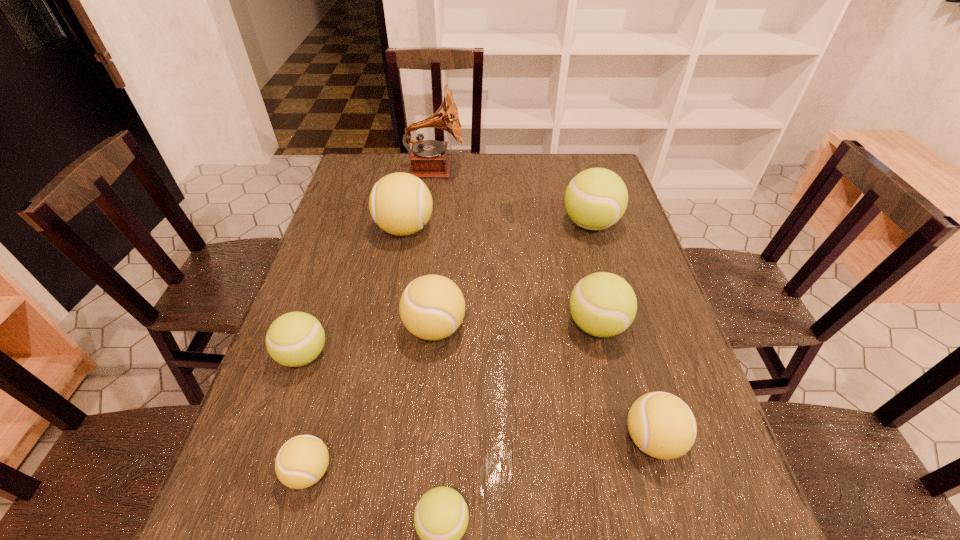
The height and width of the screenshot is (540, 960). I want to click on the tallest object, so click(x=428, y=158).

The height and width of the screenshot is (540, 960). Identify the location of phonograph_record. (428, 158).

This screenshot has width=960, height=540. Find the location of `the biggest green tennis ball`. the biggest green tennis ball is located at coordinates (595, 199).

The width and height of the screenshot is (960, 540). I want to click on the farthest yellow tennis ball, so click(x=400, y=203).

I want to click on the second farthest yellow tennis ball, so click(432, 307).

This screenshot has height=540, width=960. In order to click on the third smallest green tennis ball in this screenshot , I will do `click(602, 304)`.

Where is `the third biggest yellow tennis ball`? the third biggest yellow tennis ball is located at coordinates (662, 425).

Where is `the leftmost green tennis ball`? The width and height of the screenshot is (960, 540). the leftmost green tennis ball is located at coordinates (294, 339).

The height and width of the screenshot is (540, 960). In order to click on the smallest yellow tennis ball in this screenshot , I will do `click(301, 462)`.

You are a GUI agent. You are given a task and a screenshot of the screen. Output one action in this format:
    pyautogui.click(x=<x>, y=<y>)
    Task: Click on the vacant space located 0.080m on the horn of the phonograph_record
    This screenshot has height=540, width=960.
    Given the screenshot: What is the action you would take?
    pyautogui.click(x=487, y=168)